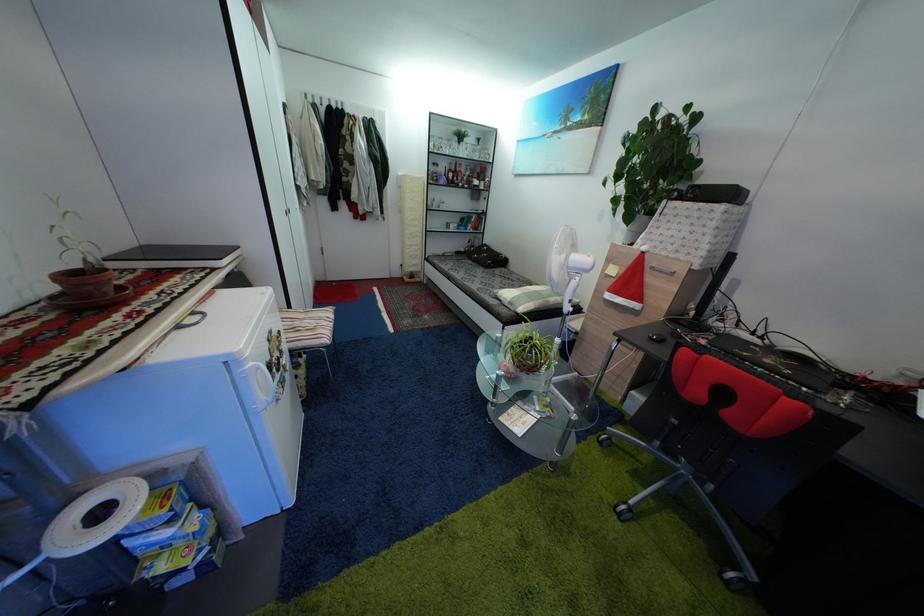
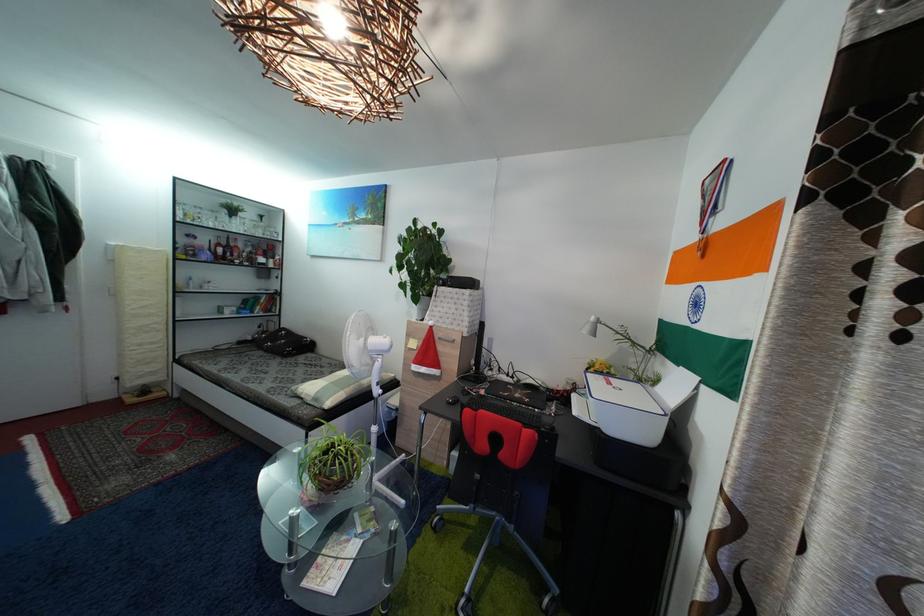
Locate, in the second image, the point that corresponds to (x=462, y=176) in the first image.

(233, 251)